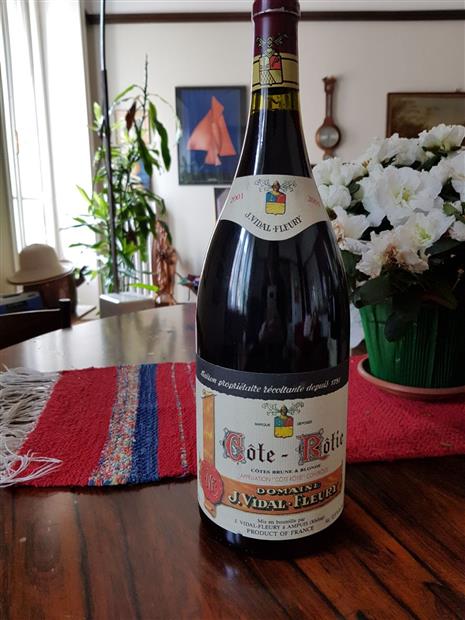
At what (x,y) coordinates should I click in order to perform the action: click on white wall to right and left of bottle. Please return your answer as a coordinate pair (x, y). This screenshot has height=620, width=465. Looking at the image, I should click on (190, 49), (376, 53).